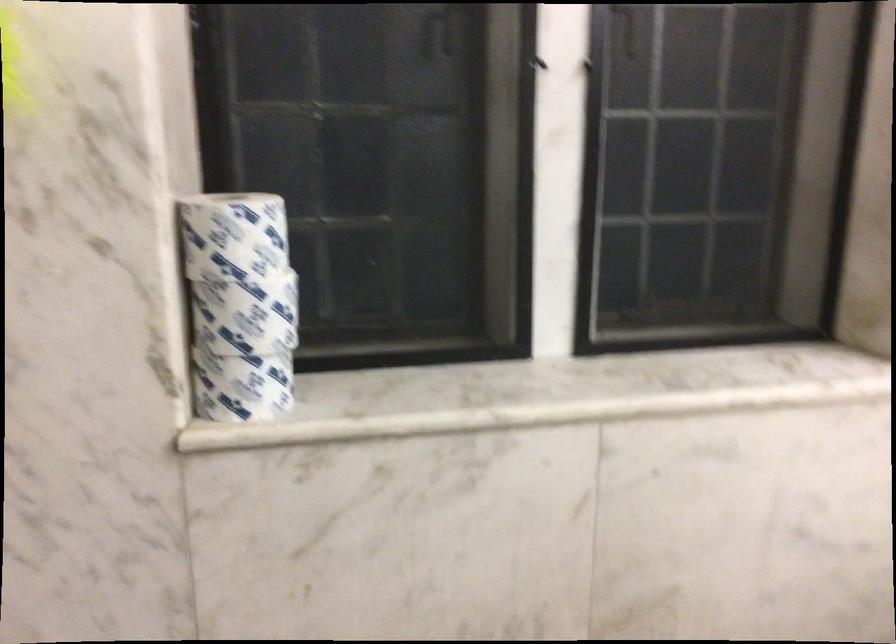
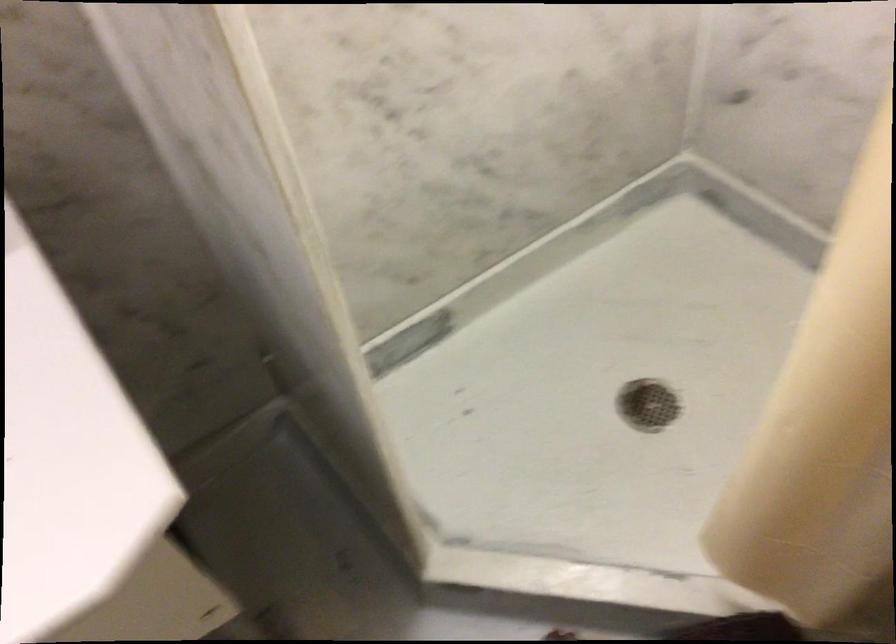
Based on the continuous images, in which direction is the camera rotating?

The camera's rotation is toward right-down.